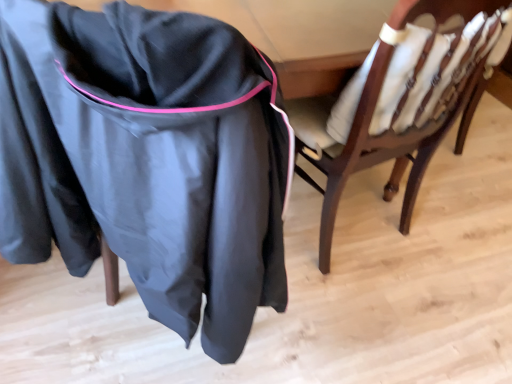
Locate an element on the screen. The image size is (512, 384). free point to the right of matte black jacket at left is located at coordinates (367, 321).